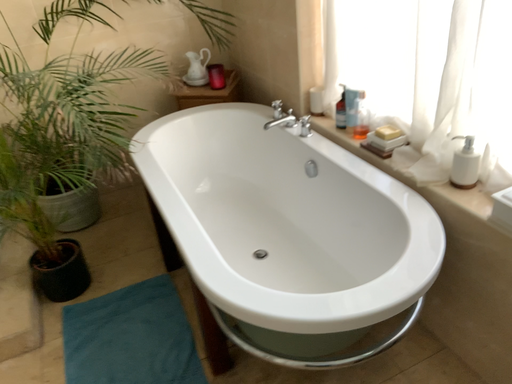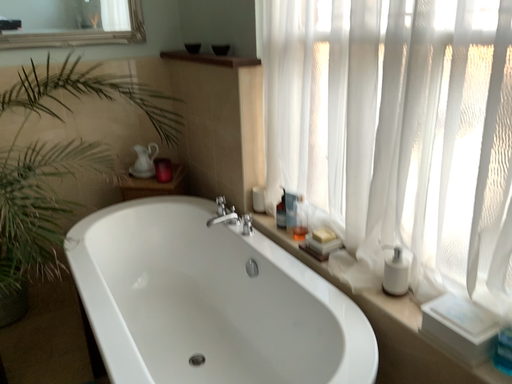
Question: Which way did the camera rotate in the video?

Choices:
 (A) rotated left
 (B) rotated right

Answer: (B)